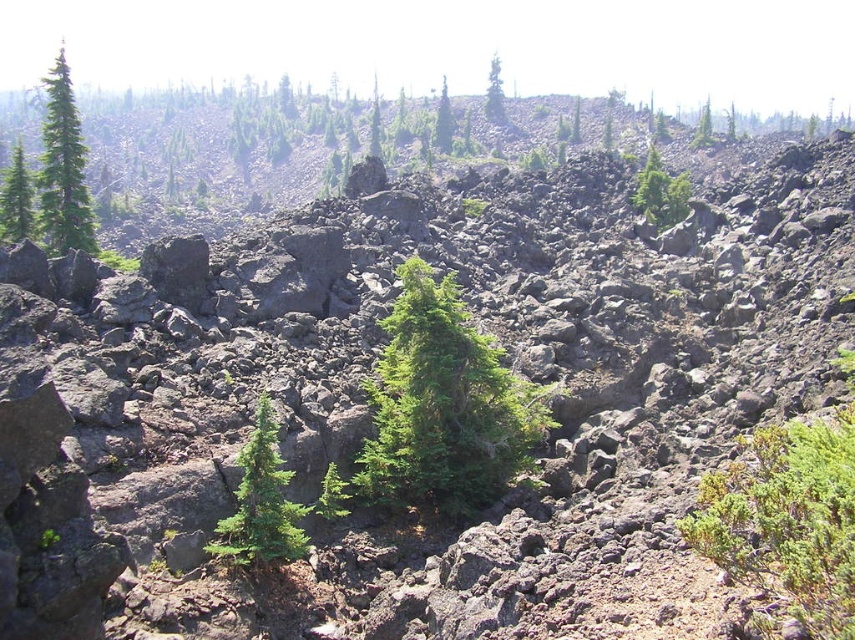
Question: Which object appears farthest from the camera in this image?

Choices:
 (A) green textured tree at center
 (B) green leafy tree at upper right
 (C) green matte tree at left
 (D) green shrub at lower right

Answer: (B)

Question: Which point is closer to the camera taking this photo?

Choices:
 (A) (422, 282)
 (B) (7, 202)
 (C) (659, 166)

Answer: (A)

Question: Is the position of green leafy tree at upper right less distant than that of green leafy tree at upper center?

Choices:
 (A) no
 (B) yes

Answer: (B)

Question: Does green matte tree at upper left appear on the left side of green matte tree at upper center?

Choices:
 (A) no
 (B) yes

Answer: (B)

Question: Which of the following is the farthest from the observer?

Choices:
 (A) (733, 516)
 (B) (646, 173)
 (C) (439, 106)

Answer: (C)

Question: Can you confirm if green matte tree at upper left is wider than green matte tree at left?

Choices:
 (A) no
 (B) yes

Answer: (B)